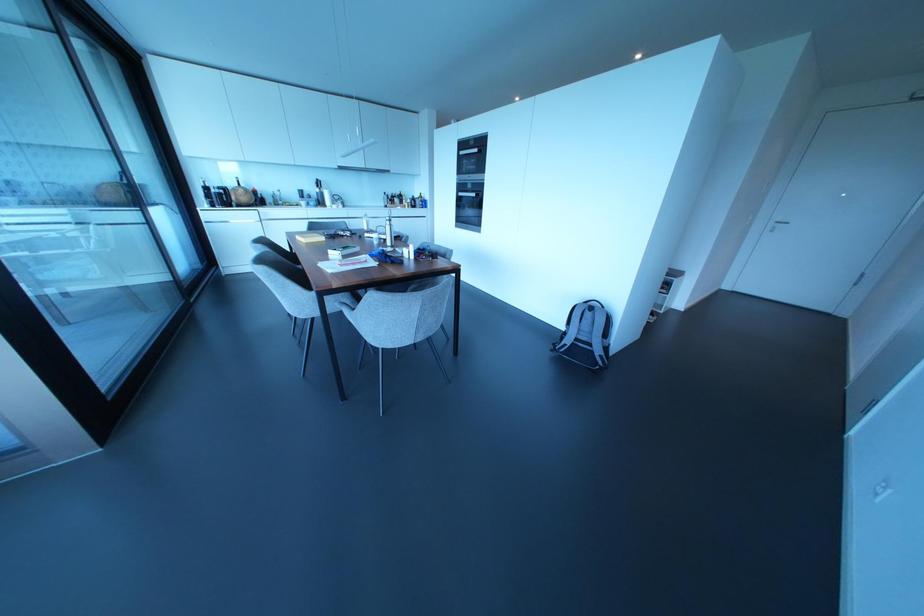
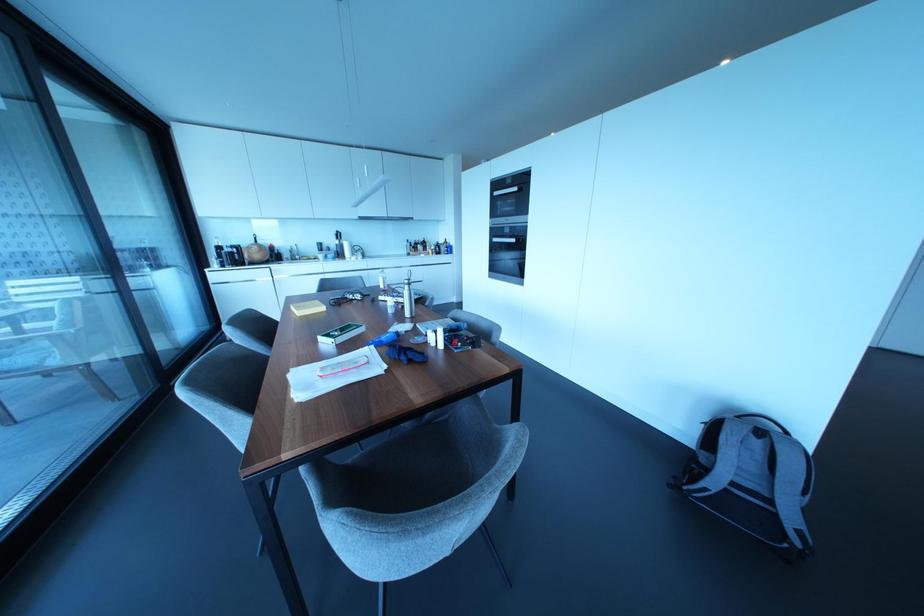
The point at (x=458, y=193) is marked in the first image. Where is the corresponding point in the second image?

(493, 238)